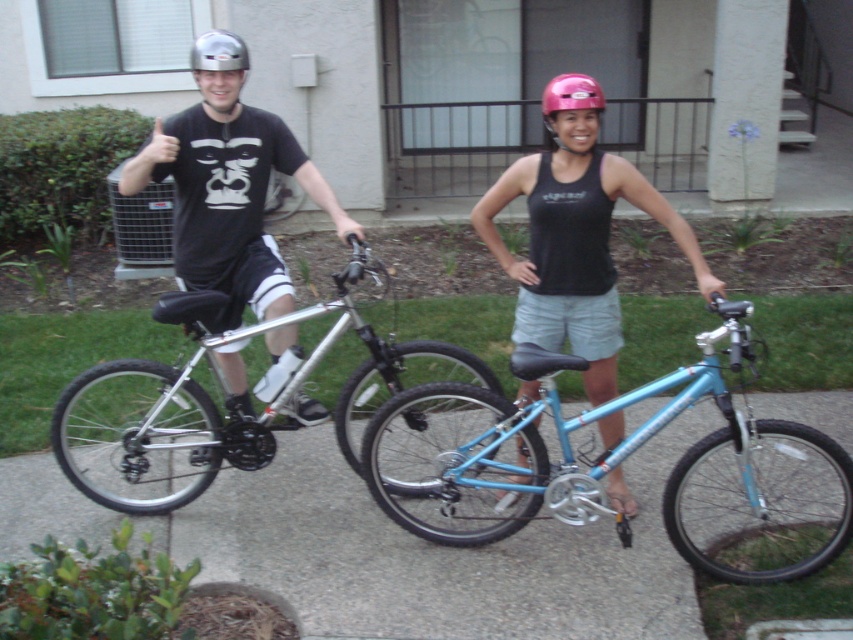
Question: Does gray asphalt pavement at center appear under light blue metallic bicycle at center?

Choices:
 (A) yes
 (B) no

Answer: (A)

Question: Observing the image, what is the correct spatial positioning of silver metallic bicycle at center in reference to matte black tank top at center?

Choices:
 (A) above
 (B) below

Answer: (B)

Question: Based on their relative distances, which object is nearer to the matte black tank top at center?

Choices:
 (A) silver metallic bicycle at center
 (B) pink matte helmet at center
 (C) metallic silver helmet at upper left

Answer: (B)

Question: Which of the following is the farthest from the observer?

Choices:
 (A) (820, 458)
 (B) (242, 413)

Answer: (A)

Question: Can you confirm if silver metallic bicycle at center is wider than pink matte helmet at center?

Choices:
 (A) no
 (B) yes

Answer: (B)

Question: Among these points, which one is nearest to the camera?

Choices:
 (A) (206, 35)
 (B) (576, 282)
 (C) (299, 474)
 (D) (190, 246)

Answer: (B)